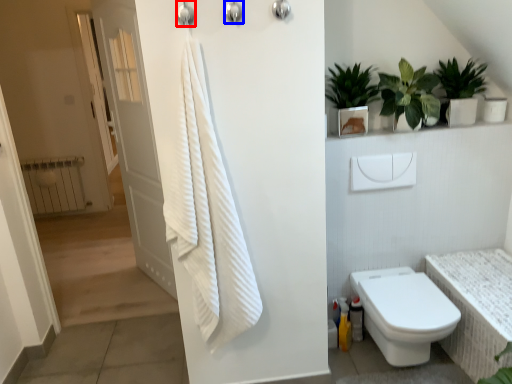
Question: Which object appears farthest to the camera in this image, shower (highlighted by a red box) or shower (highlighted by a blue box)?

Choices:
 (A) shower
 (B) shower

Answer: (B)